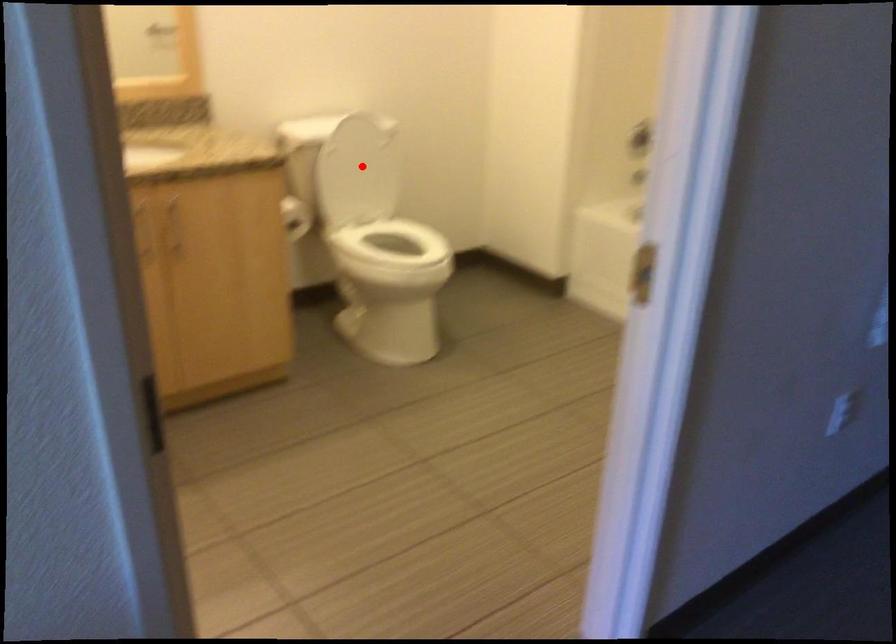
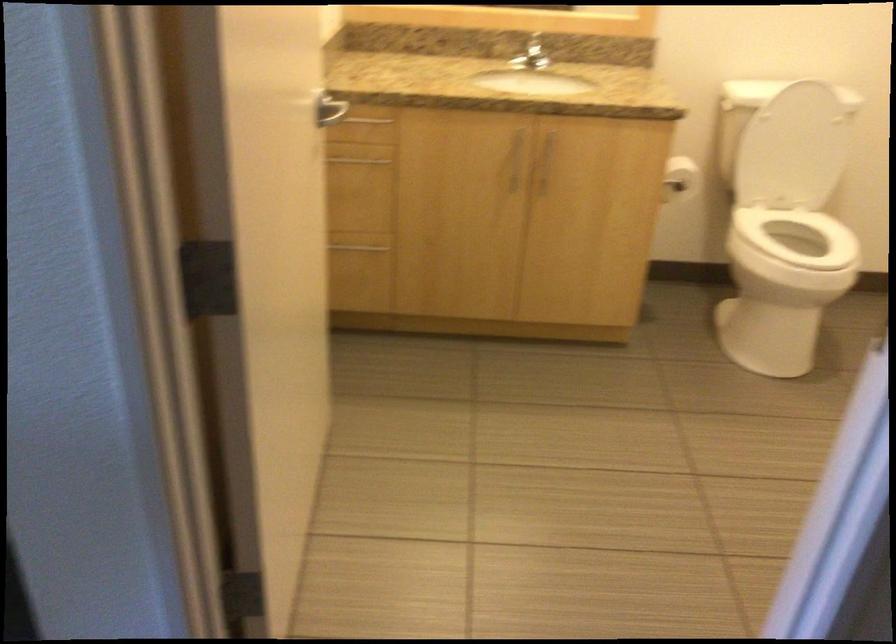
Locate, in the second image, the point that corresponds to the highlighted location in the first image.

(793, 149)